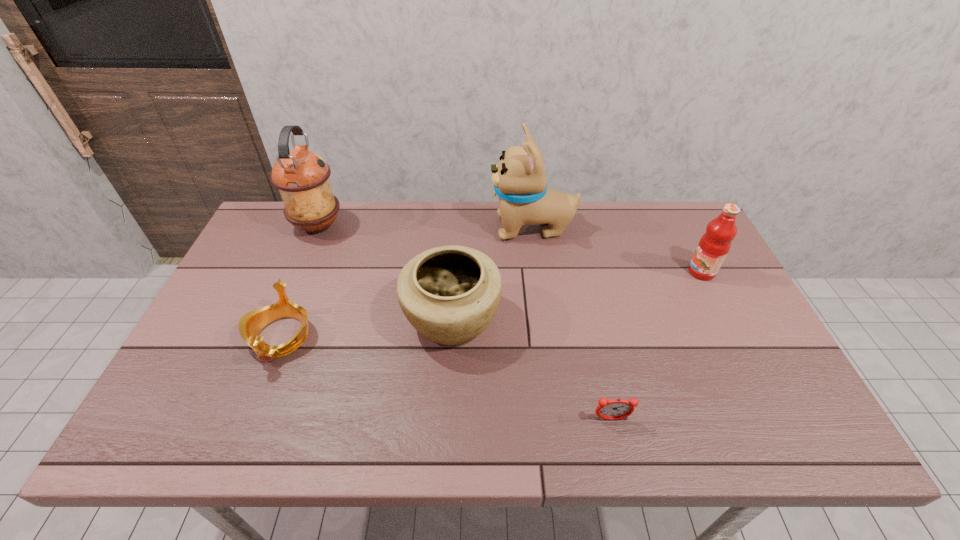
This screenshot has width=960, height=540. I want to click on oil lamp that is at the left edge, so click(x=302, y=177).

I want to click on tiara at the left edge, so click(250, 325).

Identify the location of object located in the right edge section of the desktop. (714, 245).

Where is `object that is at the far left corner`? This screenshot has width=960, height=540. object that is at the far left corner is located at coordinates (302, 177).

Find the location of a particular element. This screenshot has height=540, width=960. vacant space at the far edge is located at coordinates (493, 238).

The width and height of the screenshot is (960, 540). What are the coordinates of `vacant space at the near edge of the desktop` in the screenshot? It's located at (630, 442).

Locate an element on the screen. The image size is (960, 540). vacant space at the left edge of the desktop is located at coordinates (187, 354).

Image resolution: width=960 pixels, height=540 pixels. In the image, there is a desktop. In order to click on vacant space at the right edge in this screenshot , I will do `click(770, 393)`.

Where is `free location at the far right corner of the desktop`? Image resolution: width=960 pixels, height=540 pixels. free location at the far right corner of the desktop is located at coordinates (653, 205).

Where is `vacant area between the shortest object and the fourth shortest object`? The image size is (960, 540). vacant area between the shortest object and the fourth shortest object is located at coordinates (657, 346).